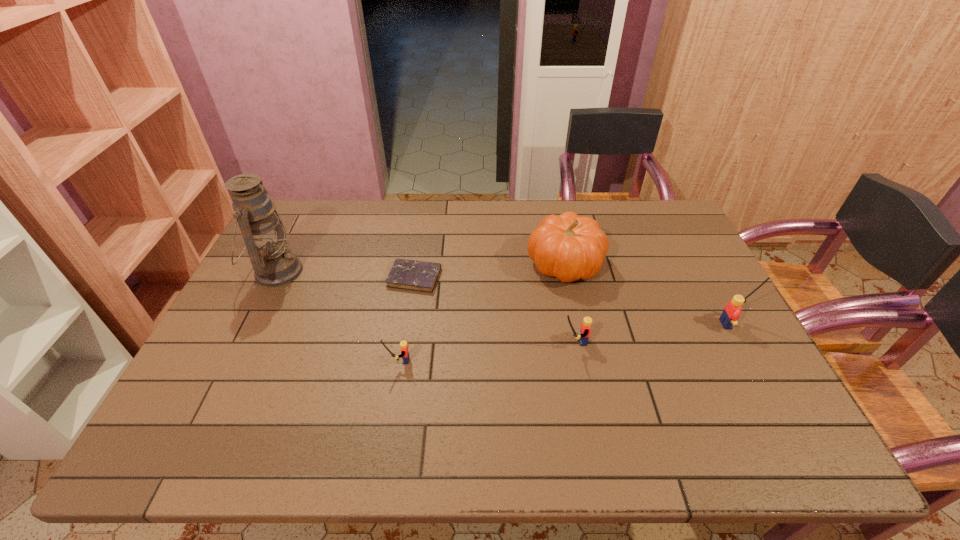
The width and height of the screenshot is (960, 540). I want to click on the nearest Lego, so click(x=404, y=354).

In order to click on the leftmost Lego in this screenshot , I will do `click(404, 354)`.

Find the location of `the second tallest Lego`. the second tallest Lego is located at coordinates (585, 328).

The image size is (960, 540). I want to click on the third shortest object, so click(585, 328).

Identify the location of the rightmost object. (732, 310).

At what (x,y) coordinates should I click in order to perform the action: click on the rightmost Lego. Please return your answer as a coordinate pair (x, y). The width and height of the screenshot is (960, 540). Looking at the image, I should click on (732, 310).

This screenshot has height=540, width=960. In order to click on the shortest object in this screenshot , I will do `click(414, 275)`.

Identify the location of pumpkin. Image resolution: width=960 pixels, height=540 pixels. coord(568,247).

You are a GUI agent. You are given a task and a screenshot of the screen. Output one action in this format:
    pyautogui.click(x=<x>, y=<y>)
    Task: Click on the tallest object
    
    Given the screenshot: What is the action you would take?
    coord(274,264)

Locate an element on the screen. the leftmost object is located at coordinates (274, 264).